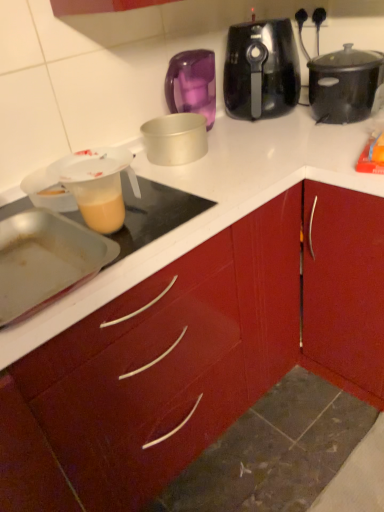
Where is `vacant region to the left of black matte slow cooker at upper right, which appears as the first slow cooker when viewed from the right`? vacant region to the left of black matte slow cooker at upper right, which appears as the first slow cooker when viewed from the right is located at coordinates (287, 133).